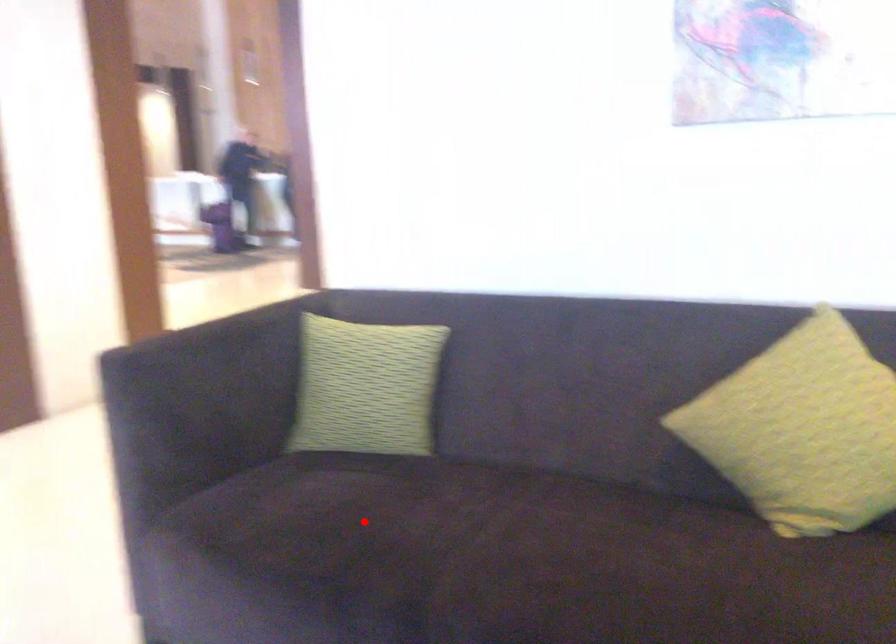
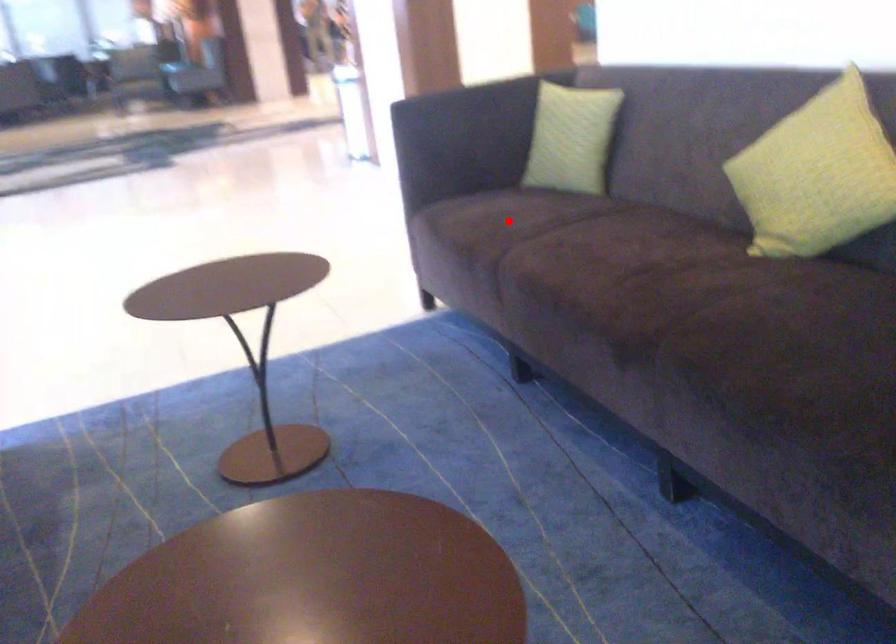
I am providing you with two images of the same scene from different viewpoints. A red point is marked on the first image and another point is marked on the second image. Are the points marked in image1 and image2 representing the same 3D position?

Yes